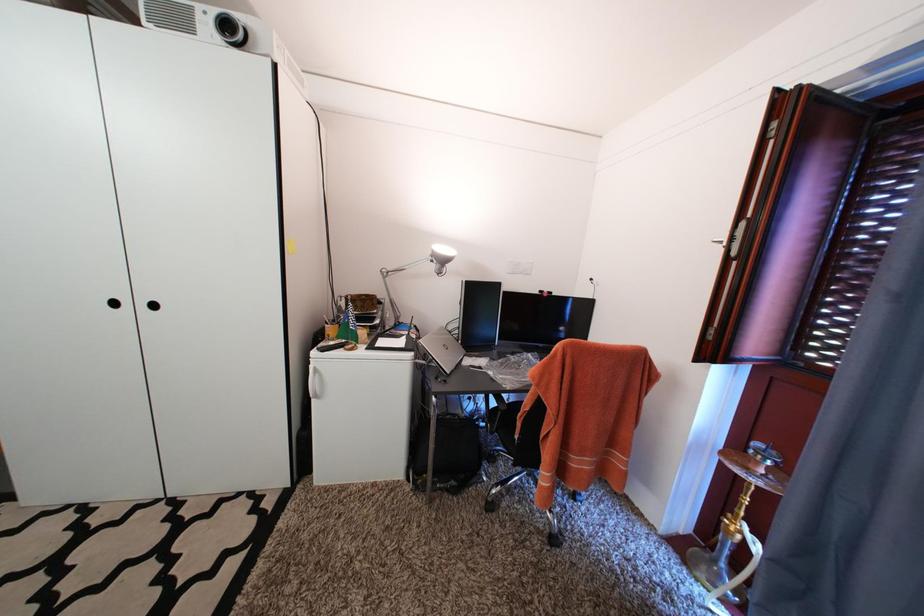
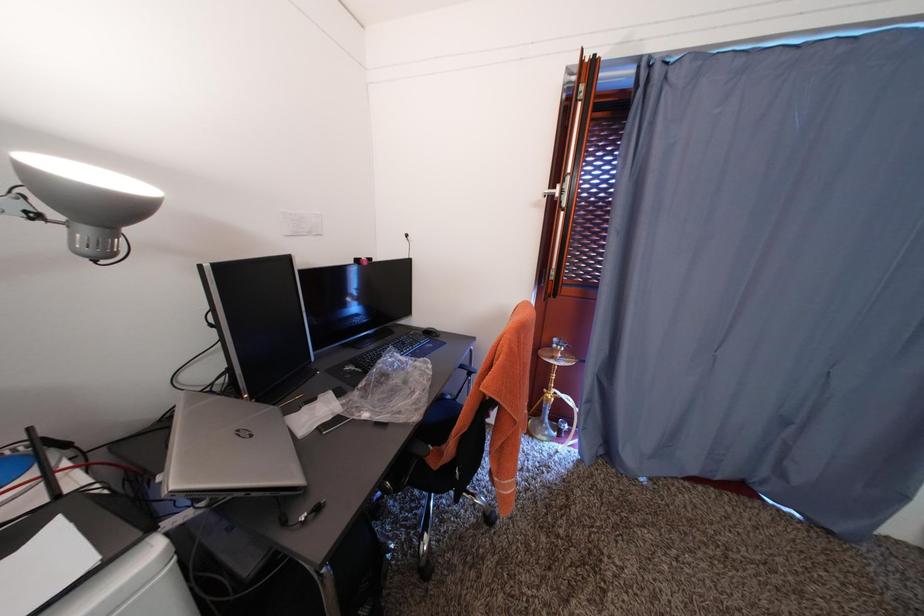
First-person continuous shooting, in which direction is the camera rotating?

The camera's rotation is toward right-down.